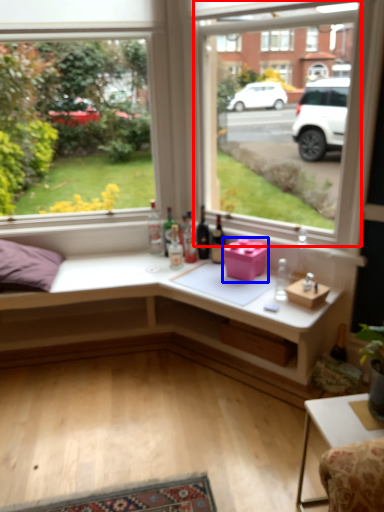
Question: Which point is closer to the camera, window (highlighted by a red box) or window box (highlighted by a blue box)?

Choices:
 (A) window
 (B) window box

Answer: (A)